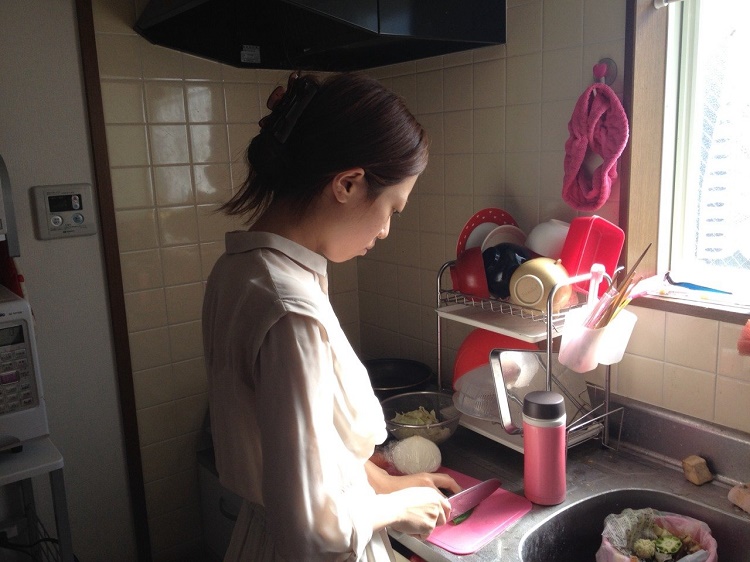
Identify the location of cannister. The width and height of the screenshot is (750, 562). (550, 468).